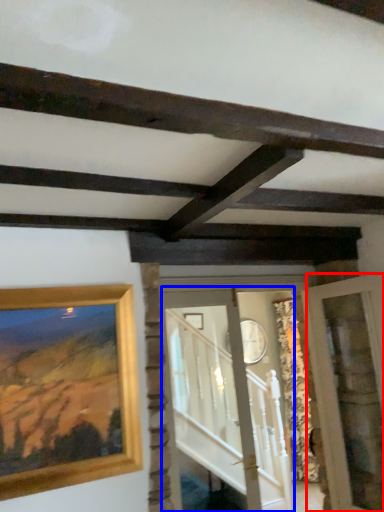
Question: Which of the following is the farthest to the observer, glass door (highlighted by a red box) or glass door (highlighted by a blue box)?

Choices:
 (A) glass door
 (B) glass door

Answer: (B)